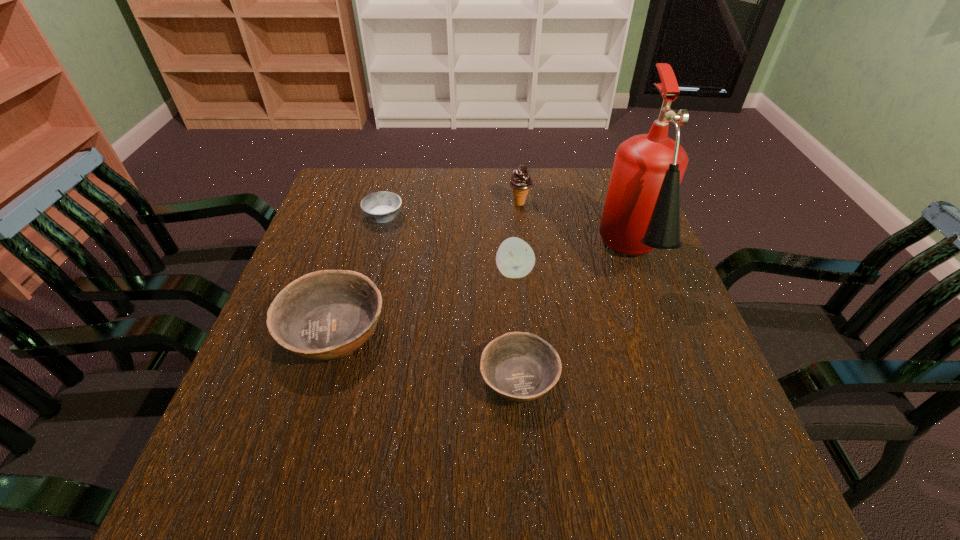
You are a GUI agent. You are given a task and a screenshot of the screen. Output one action in this format:
    pyautogui.click(x=<x>, y=<y>)
    Task: Click on the object that is at the far left corner
    This screenshot has height=540, width=960.
    Given the screenshot: What is the action you would take?
    pyautogui.click(x=381, y=207)

I want to click on blank space at the far edge, so click(409, 199).

Where is `blank space at the near edge of the desktop`? This screenshot has width=960, height=540. blank space at the near edge of the desktop is located at coordinates (338, 406).

This screenshot has height=540, width=960. In order to click on free spot at the left edge of the desktop in this screenshot , I will do `click(337, 247)`.

In the image, there is a desktop. Where is `vacant space at the right edge`? vacant space at the right edge is located at coordinates (648, 296).

Identify the location of vacant space at the far left corner. (356, 206).

You are a GUI agent. You are given a task and a screenshot of the screen. Output one action in this format:
    pyautogui.click(x=<x>, y=<y>)
    Task: Click on the vacant area at the far right corner of the desktop
    This screenshot has height=540, width=960.
    Given the screenshot: What is the action you would take?
    pyautogui.click(x=601, y=197)

Find the location of a particular element. The width and height of the screenshot is (960, 540). blank region between the icecream and the fire extinguisher is located at coordinates (576, 231).

The height and width of the screenshot is (540, 960). What are the coordinates of `free space between the fourth tallest object and the rightmost object` in the screenshot? It's located at (483, 295).

Where is `vacant space that's between the rightmost object and the right bowl`? Image resolution: width=960 pixels, height=540 pixels. vacant space that's between the rightmost object and the right bowl is located at coordinates (576, 318).